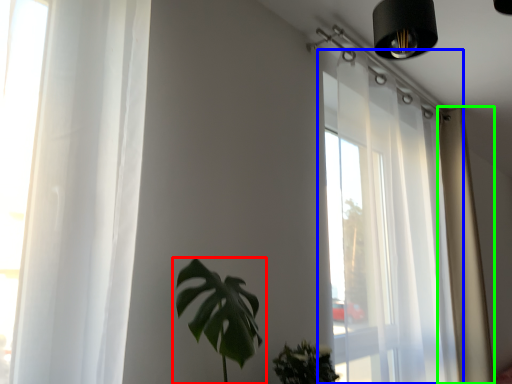
Question: Which object is the closest to the houseplant (highlighted by a red box)? Choose among these: window (highlighted by a blue box) or curtain (highlighted by a green box).

Choices:
 (A) window
 (B) curtain

Answer: (A)